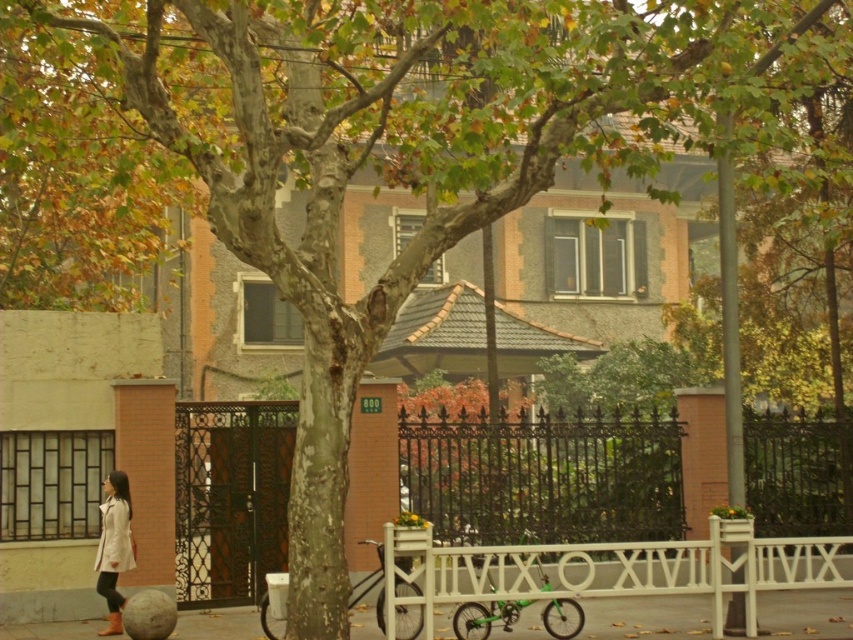
You are a delivery person trying to park your van. You see the white painted metal fence at center and the smooth concrete pavement at lower center. Which surface can you park your van on?

The smooth concrete pavement at lower center is a suitable surface for parking the van, as the white painted metal fence at center is larger in size but not appropriate for parking.

Based on the photo, you are a delivery person trying to see if you can fit a large package through the space between the white painted metal fence at center and the light beige coat at lower left. Based on their sizes, can the package pass through?

The white painted metal fence at center is larger in size than the light beige coat at lower left. Since the fence is bigger, the space between them might be too narrow for the package to pass through. You should check the exact dimensions before attempting to move the package through.